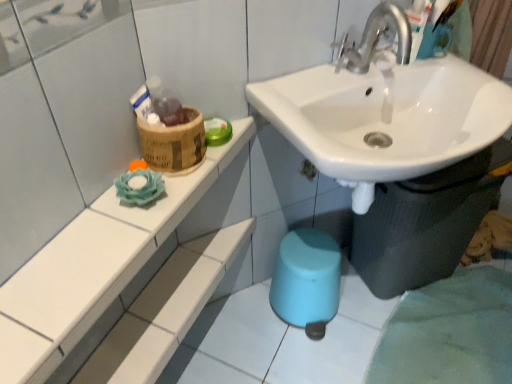
Question: Is bamboo basket at upper left inside white glossy sink at center?

Choices:
 (A) yes
 (B) no

Answer: (B)

Question: Is white glossy sink at center in contact with bamboo basket at upper left?

Choices:
 (A) yes
 (B) no

Answer: (B)

Question: Would you say white glossy sink at center is outside bamboo basket at upper left?

Choices:
 (A) yes
 (B) no

Answer: (A)

Question: From a real-world perspective, is white glossy sink at center positioned under bamboo basket at upper left based on gravity?

Choices:
 (A) no
 (B) yes

Answer: (B)

Question: Is white glossy sink at center positioned with its back to bamboo basket at upper left?

Choices:
 (A) no
 (B) yes

Answer: (A)

Question: Could you tell me if white glossy sink at center is turned towards bamboo basket at upper left?

Choices:
 (A) no
 (B) yes

Answer: (A)

Question: Does bamboo basket at upper left have a smaller size compared to white ceramic shelf at upper left?

Choices:
 (A) no
 (B) yes

Answer: (B)

Question: Is bamboo basket at upper left to the left of white ceramic shelf at upper left from the viewer's perspective?

Choices:
 (A) yes
 (B) no

Answer: (B)

Question: From a real-world perspective, is bamboo basket at upper left beneath white ceramic shelf at upper left?

Choices:
 (A) yes
 (B) no

Answer: (B)

Question: Is bamboo basket at upper left positioned far away from white ceramic shelf at upper left?

Choices:
 (A) no
 (B) yes

Answer: (A)

Question: Is white ceramic shelf at upper left inside bamboo basket at upper left?

Choices:
 (A) yes
 (B) no

Answer: (B)

Question: From the image's perspective, is bamboo basket at upper left on top of white ceramic shelf at upper left?

Choices:
 (A) yes
 (B) no

Answer: (A)

Question: Is white ceramic shelf at upper left bigger than white glossy sink at center?

Choices:
 (A) no
 (B) yes

Answer: (A)